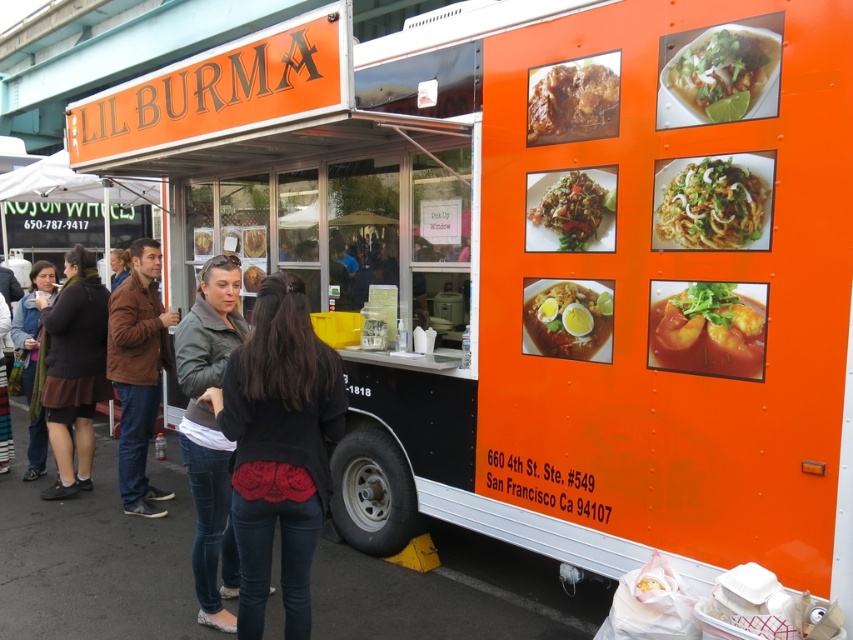
Is brown glossy meat at upper center further to the viewer compared to matte black jacket at left?

No, brown glossy meat at upper center is closer to the viewer.

Between brown glossy meat at upper center and matte black jacket at left, which one is positioned lower?

matte black jacket at left is lower down.

Find the location of a particular element. This screenshot has width=853, height=640. brown glossy meat at upper center is located at coordinates tap(573, 104).

Can you confirm if tomato sauce with shrimp at center is smaller than brown glossy meat at upper center?

No.

Between tomato sauce with shrimp at center and brown glossy meat at upper center, which one has more height?

tomato sauce with shrimp at center is taller.

Which is behind, point (653, 342) or point (527, 102)?

Positioned behind is point (527, 102).

Locate an element on the screen. This screenshot has width=853, height=640. tomato sauce with shrimp at center is located at coordinates (708, 326).

Based on the photo, which is more to the right, dark gray leather jacket at center or leather jacket at center?

From the viewer's perspective, dark gray leather jacket at center appears more on the right side.

Is dark gray leather jacket at center taller than leather jacket at center?

In fact, dark gray leather jacket at center may be shorter than leather jacket at center.

Does point (250, 605) come behind point (184, 356)?

No, it is in front of (184, 356).

Locate an element on the screen. This screenshot has width=853, height=640. dark gray leather jacket at center is located at coordinates (279, 449).